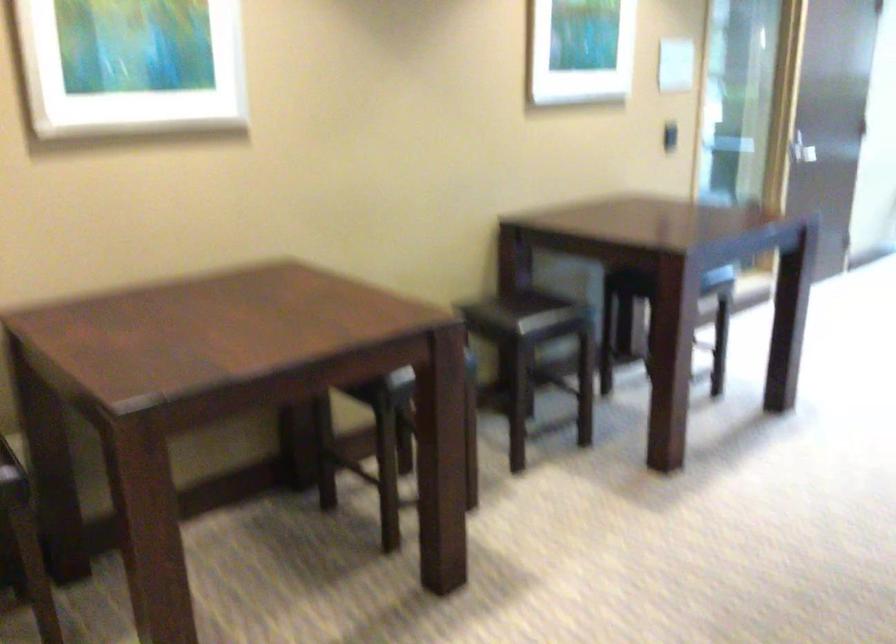
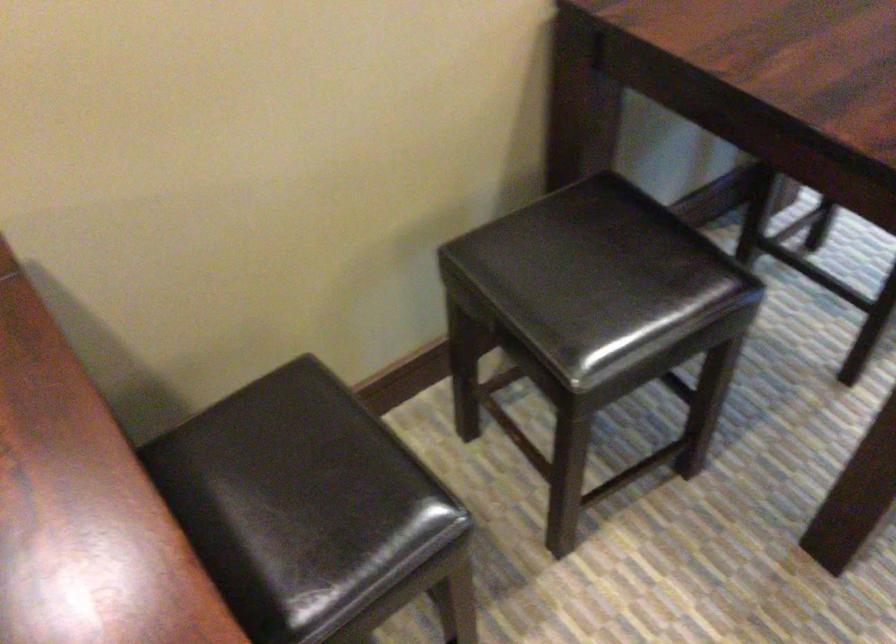
Question: In a continuous first-person perspective shot, in which direction is the camera moving?

Choices:
 (A) Left
 (B) Right
 (C) Forward
 (D) Backward

Answer: (C)